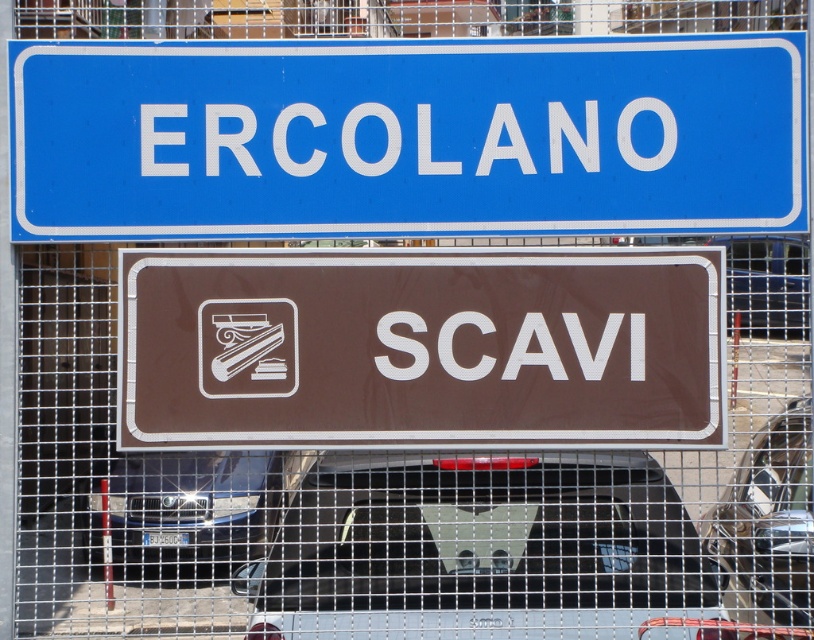
Does point (528, 502) lie in front of point (795, 401)?

Yes.

Between black matte car at lower center and metallic silver car at center, which one has more height?

Standing taller between the two is metallic silver car at center.

Is point (591, 458) positioned in front of point (733, 483)?

Yes.

This screenshot has width=814, height=640. In order to click on black matte car at lower center in this screenshot , I will do `click(480, 548)`.

Who is positioned more to the right, blue plastic signboard at upper center or black metallic car at center?

blue plastic signboard at upper center is more to the right.

Image resolution: width=814 pixels, height=640 pixels. Find the location of `blue plastic signboard at upper center`. blue plastic signboard at upper center is located at coordinates coord(407,136).

Is point (694, 300) in front of point (740, 515)?

Yes, point (694, 300) is in front of point (740, 515).

Can you confirm if brown plastic sign at center is positioned above metallic silver car at center?

Correct, brown plastic sign at center is located above metallic silver car at center.

Locate an element on the screen. The width and height of the screenshot is (814, 640). brown plastic sign at center is located at coordinates (419, 348).